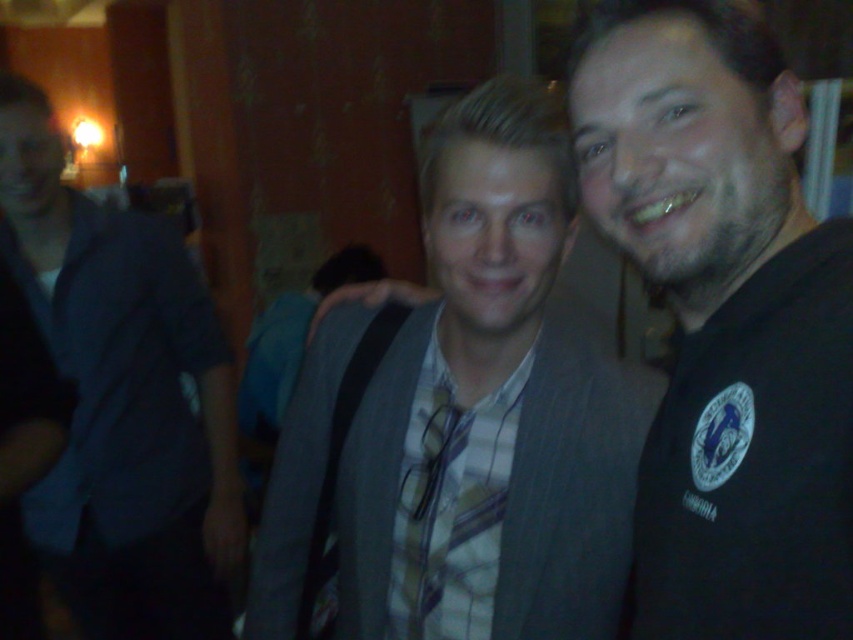
Question: Does matte gray suit at center appear on the right side of dark blue shirt at left?

Choices:
 (A) no
 (B) yes

Answer: (B)

Question: Which point is farther to the camera?

Choices:
 (A) matte gray suit at center
 (B) dark blue shirt at left

Answer: (B)

Question: Which object appears farthest from the camera in this image?

Choices:
 (A) matte gray suit at center
 (B) dark blue shirt at left
 (C) yellow plaid tie at center

Answer: (B)

Question: Which point is farther to the camera?

Choices:
 (A) (204, 401)
 (B) (403, 579)
 (C) (732, 180)

Answer: (A)

Question: Is matte gray suit at center behind yellow plaid tie at center?

Choices:
 (A) yes
 (B) no

Answer: (B)

Question: Can you confirm if matte gray suit at center is bigger than yellow plaid tie at center?

Choices:
 (A) yes
 (B) no

Answer: (A)